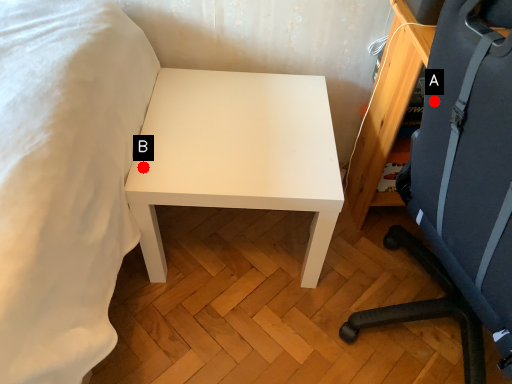
Question: Two points are circled on the image, labeled by A and B beside each circle. Among these points, which one is farthest from the camera?

Choices:
 (A) A is further
 (B) B is further

Answer: (B)